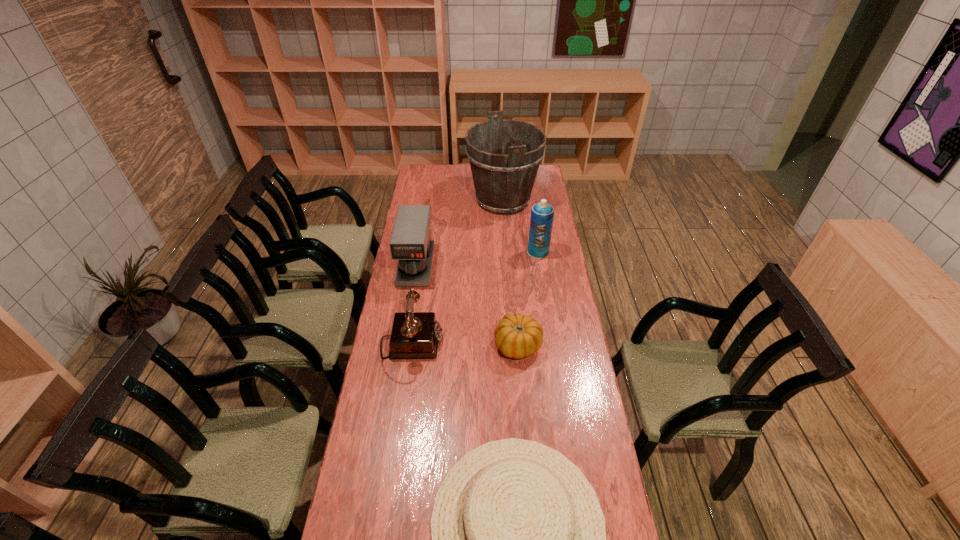
Find the location of `blank space at the far left corner`. blank space at the far left corner is located at coordinates (417, 176).

You are a GUI agent. You are given a task and a screenshot of the screen. Output one action in this format:
    pyautogui.click(x=<x>, y=<y>)
    Task: Click on the vacant area that lies between the bucket and the fourth shortest object
    Image resolution: width=960 pixels, height=540 pixels.
    Given the screenshot: What is the action you would take?
    (x=460, y=233)

You are a GUI agent. You are given a task and a screenshot of the screen. Output one action in this format:
    pyautogui.click(x=<x>, y=<y>)
    Task: Click on the vacant space that's between the fourth tallest object and the aerosol can
    The height and width of the screenshot is (540, 960).
    Given the screenshot: What is the action you would take?
    pyautogui.click(x=475, y=298)

Where is `free space between the aerosol can and the tallest object`? This screenshot has width=960, height=540. free space between the aerosol can and the tallest object is located at coordinates (520, 226).

Locate an element on the screen. This screenshot has height=540, width=960. empty space between the gourd and the fifth shortest object is located at coordinates (528, 299).

This screenshot has width=960, height=540. In order to click on vacant area that lies between the second shortest object and the telephone in this screenshot , I will do 465,345.

Locate an element on the screen. object that stands as the fifth closest to the nearest object is located at coordinates (504, 155).

The width and height of the screenshot is (960, 540). Find the location of `the closest object to the farthest object`. the closest object to the farthest object is located at coordinates (542, 214).